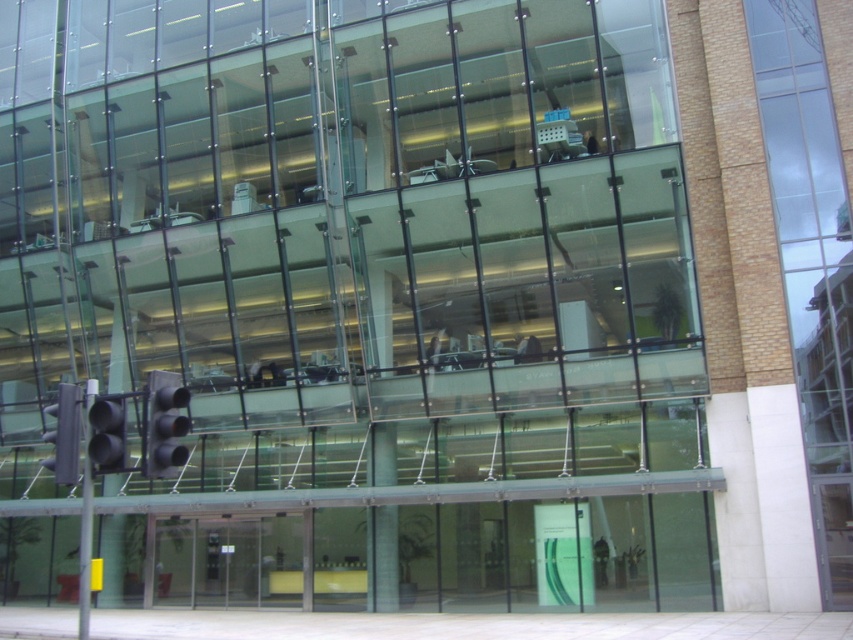
Who is shorter, black matte traffic light at lower left or gray metallic traffic light at lower left?

black matte traffic light at lower left is shorter.

Is point (189, 419) behind point (51, 442)?

That is True.

Is point (144, 417) positioned after point (68, 412)?

No, (144, 417) is closer to viewer.

I want to click on black matte traffic light at lower left, so click(x=164, y=424).

Which is more to the right, clear glass window at right or black matte traffic light at lower left?

From the viewer's perspective, clear glass window at right appears more on the right side.

Does clear glass window at right have a greater width compared to black matte traffic light at lower left?

Yes, clear glass window at right is wider than black matte traffic light at lower left.

Does point (795, 147) come in front of point (160, 464)?

No, (795, 147) is further to viewer.

Identify the location of clear glass window at right. (811, 262).

Is clear glass window at right to the right of gray metallic traffic light at lower left from the viewer's perspective?

Yes, clear glass window at right is to the right of gray metallic traffic light at lower left.

Measure the distance between point (798, 134) and camera.

The distance of point (798, 134) from camera is 18.55 meters.

Is point (842, 225) farther from viewer compared to point (59, 432)?

That is True.

The height and width of the screenshot is (640, 853). Identify the location of clear glass window at right. (811, 262).